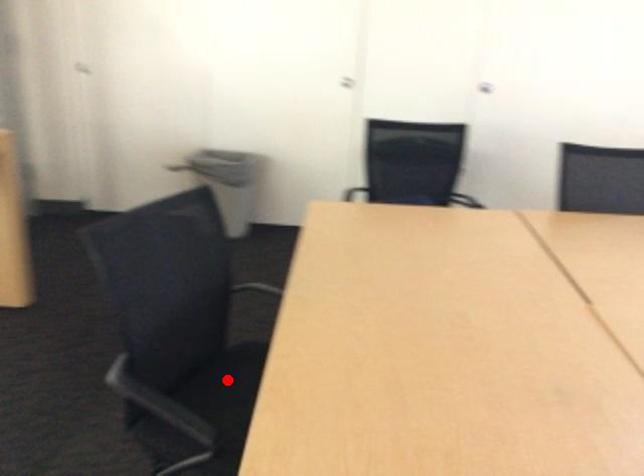
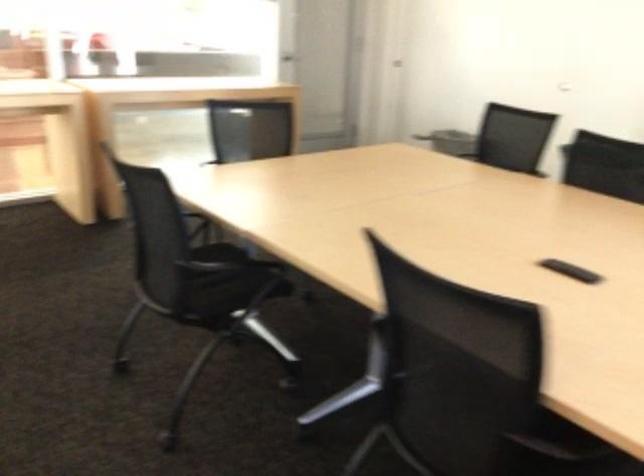
Question: I am providing you with two images of the same scene from different viewpoints. A red point is marked on the first image. Can you still see the location of the red point in image 2?

Choices:
 (A) Yes
 (B) No

Answer: (B)